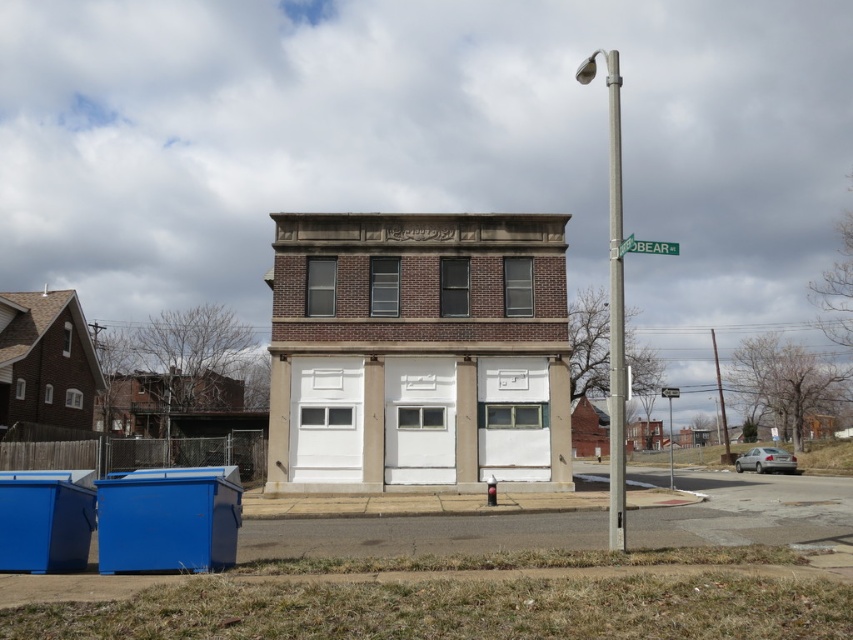
Consider the image. You are a delivery driver approaching the two story brick building. You need to park your vehicle between the silver metallic pole at upper right and the green plastic street sign at upper center. Is there enough space between them to park your vehicle?

The silver metallic pole at upper right is in front of the green plastic street sign at upper center, meaning they are aligned along the same line from your perspective. This suggests there is no space between them for parking your vehicle.

You are standing on the sidewalk in front of the two story brick building. You see two points marked on the ground, one at point (614, 67) and the other at point (628, 250). Which point is closer to you?

Point (628, 250) is closer to you because it is less further to the camera than point (614, 67).